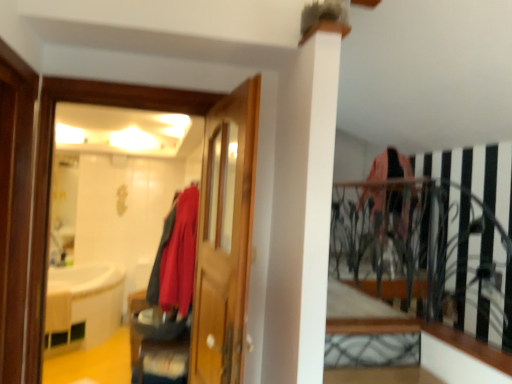
Question: From a real-world perspective, is matte wooden mirror at left above or below matte red coat at center?

Choices:
 (A) below
 (B) above

Answer: (B)

Question: Based on their positions, is matte wooden mirror at left located to the left or right of matte red coat at center?

Choices:
 (A) right
 (B) left

Answer: (A)

Question: Which of these objects is positioned closest to the wooden door at center?

Choices:
 (A) matte red coat at center
 (B) matte wooden mirror at left
 (C) white wood ledge at lower right
 (D) brushed metal shoe at lower center

Answer: (A)

Question: Which of these objects is positioned closest to the wooden door at center?

Choices:
 (A) white wood ledge at lower right
 (B) matte wooden mirror at left
 (C) matte red coat at center
 (D) brushed metal shoe at lower center

Answer: (C)